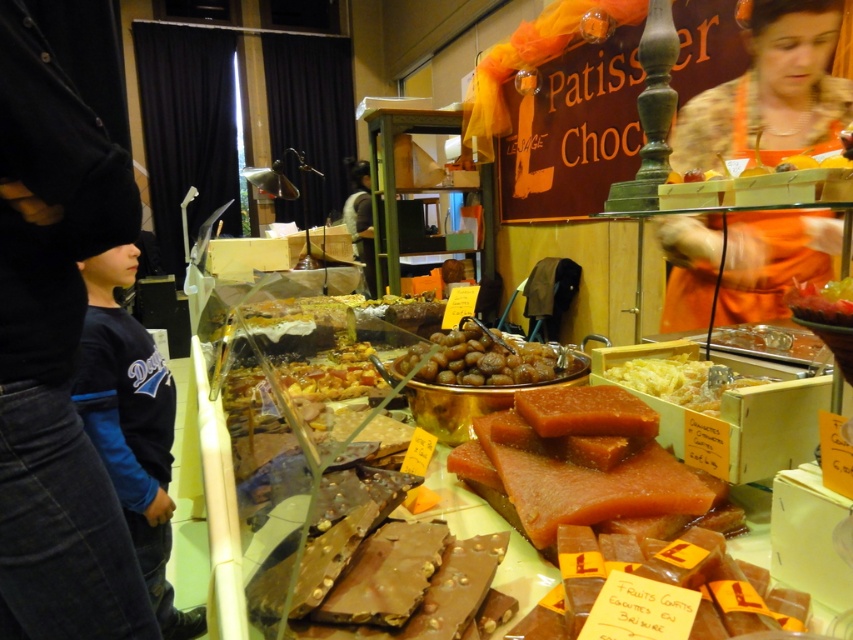
Is blue fleece jacket at left further to camera compared to glistening caramelized nuts at center?

No, blue fleece jacket at left is closer to the viewer.

Find the location of a particular element. This screenshot has width=853, height=640. blue fleece jacket at left is located at coordinates (55, 355).

You are a GUI agent. You are given a task and a screenshot of the screen. Output one action in this format:
    pyautogui.click(x=<x>, y=<y>)
    Task: Click on the blue fleece jacket at left
    This screenshot has width=853, height=640.
    Given the screenshot: What is the action you would take?
    pyautogui.click(x=55, y=355)

At what (x,y) coordinates should I click in order to perform the action: click on blue fleece jacket at left. Please return your answer as a coordinate pair (x, y). Looking at the image, I should click on (55, 355).

Does point (155, 554) lie in front of point (463, 376)?

No, (155, 554) is behind (463, 376).

Does point (80, 412) come farther from viewer compared to point (474, 326)?

That is True.

Who is more distant from viewer, [149,419] or [549,362]?

The point [149,419] is more distant.

In order to click on black fleece jacket at left in this screenshot , I will do point(131,424).

Is glistening caramelized nuts at center closer to camera compared to translucent yellow candy at center?

No.

Is glistening caramelized nuts at center above translucent yellow candy at center?

Correct, glistening caramelized nuts at center is located above translucent yellow candy at center.

What do you see at coordinates (486, 358) in the screenshot? The width and height of the screenshot is (853, 640). I see `glistening caramelized nuts at center` at bounding box center [486, 358].

Locate an element on the screen. glistening caramelized nuts at center is located at coordinates (486, 358).